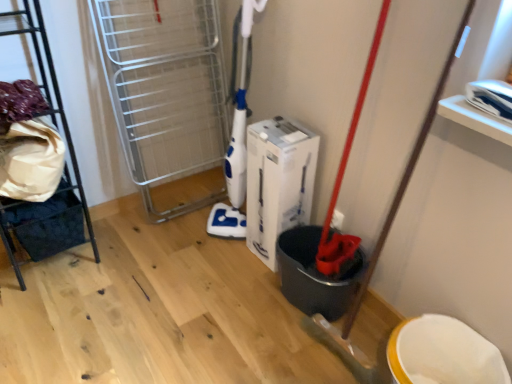
Question: Considering the positions of white cardboard box at center and metallic black rack at left in the image, is white cardboard box at center wider or thinner than metallic black rack at left?

Choices:
 (A) wide
 (B) thin

Answer: (B)

Question: From the image's perspective, is white cardboard box at center positioned above or below metallic black rack at left?

Choices:
 (A) below
 (B) above

Answer: (A)

Question: Is white cardboard box at center situated inside metallic black rack at left or outside?

Choices:
 (A) inside
 (B) outside

Answer: (B)

Question: In terms of height, does metallic black rack at left look taller or shorter compared to white cardboard box at center?

Choices:
 (A) tall
 (B) short

Answer: (A)

Question: Looking at the image, does metallic black rack at left seem bigger or smaller compared to white cardboard box at center?

Choices:
 (A) big
 (B) small

Answer: (A)

Question: Is point (32, 259) positioned closer to the camera than point (307, 210)?

Choices:
 (A) farther
 (B) closer

Answer: (A)

Question: In the image, is metallic black rack at left positioned in front of or behind white cardboard box at center?

Choices:
 (A) front
 (B) behind

Answer: (A)